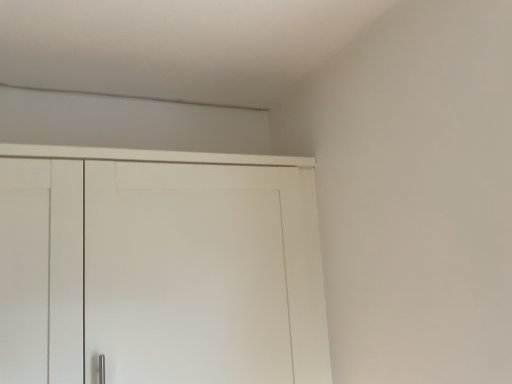
Question: Should I look upward or downward to see white matte cupboard at center?

Choices:
 (A) up
 (B) down

Answer: (B)